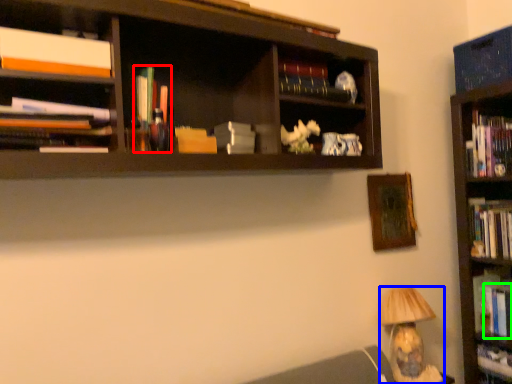
Question: Based on their relative distances, which object is farther from book (highlighted by a red box)? Choose from lamp (highlighted by a blue box) and book (highlighted by a green box).

Choices:
 (A) lamp
 (B) book

Answer: (B)